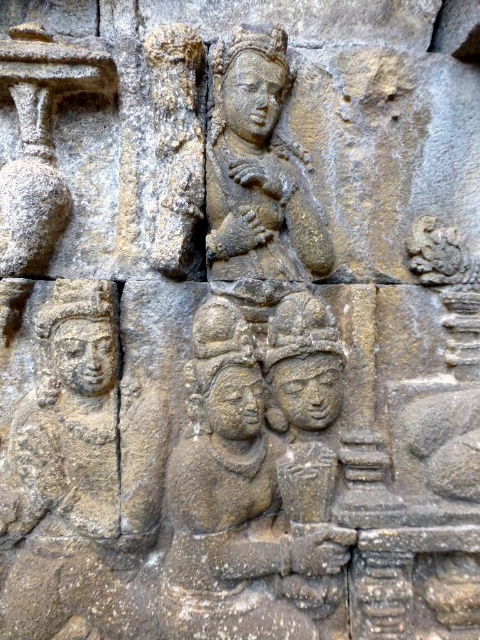
Can you confirm if gray stone figures at center is smaller than gray stone statue at upper center?

No.

Is gray stone figures at center in front of gray stone statue at upper center?

Yes, gray stone figures at center is closer to the viewer.

In order to click on gray stone figures at center in this screenshot , I will do `click(248, 486)`.